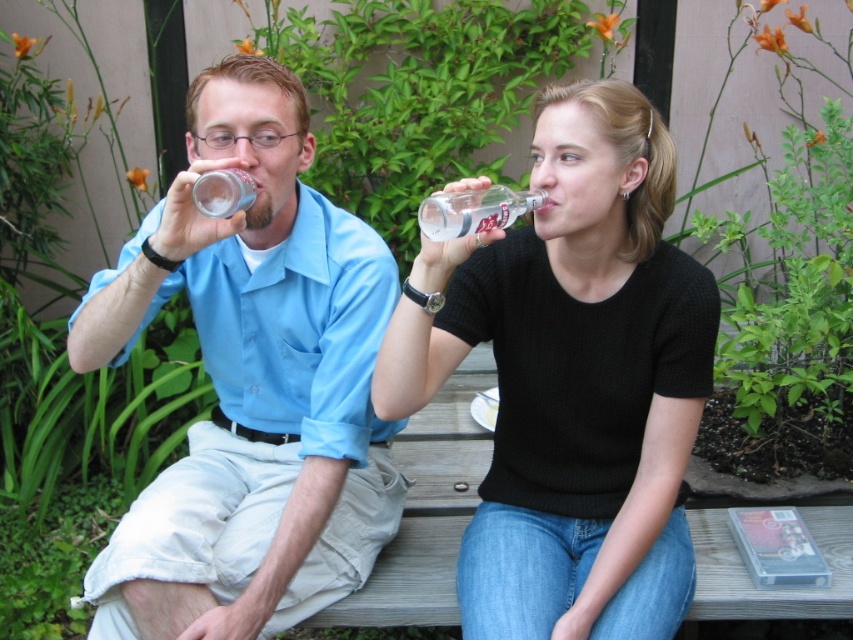
Question: Is matte plastic bottle at left thinner than clear glass bottle at upper center?

Choices:
 (A) no
 (B) yes

Answer: (A)

Question: Estimate the real-world distances between objects in this image. Which object is closer to the clear glass bottle at upper center?

Choices:
 (A) clear plastic bottle at upper center
 (B) matte plastic bottle at left
 (C) black matte water bottle at upper center

Answer: (A)

Question: Is matte plastic bottle at left closer to the viewer compared to clear glass bottle at upper center?

Choices:
 (A) yes
 (B) no

Answer: (A)

Question: Among these points, which one is farthest from the camera?

Choices:
 (A) (485, 228)
 (B) (286, 266)

Answer: (B)

Question: Which point is farther to the camera?

Choices:
 (A) clear glass bottle at upper center
 (B) black matte water bottle at upper center

Answer: (A)

Question: Can you confirm if matte plastic bottle at left is positioned below clear plastic bottle at upper center?

Choices:
 (A) no
 (B) yes

Answer: (B)